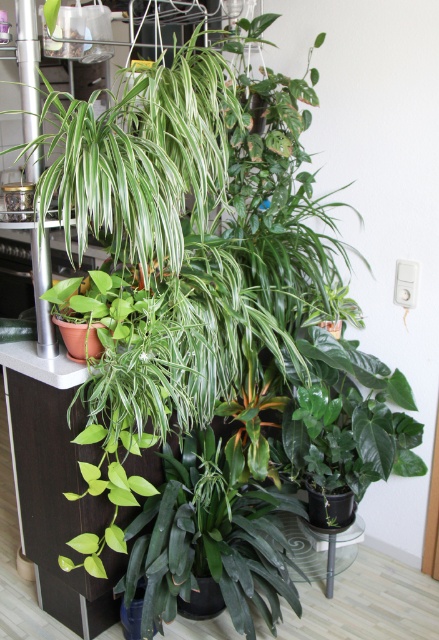
Is green matte leafy plant at center-right bigger than green matte pothos at left?

Correct, green matte leafy plant at center-right is larger in size than green matte pothos at left.

Between green matte leafy plant at center-right and green matte pothos at left, which one has less height?

With less height is green matte pothos at left.

Between point (371, 392) and point (132, 301), which one is positioned behind?

The point (371, 392) is more distant.

In order to click on green matte leafy plant at center-right in this screenshot , I will do `click(349, 419)`.